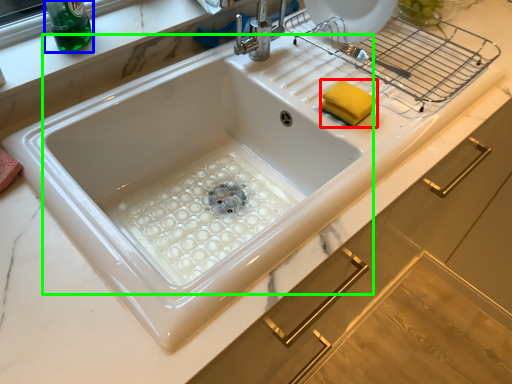
Question: Which object is positioned farthest from food (highlighted by a red box)? Select from beverage (highlighted by a blue box) and sink (highlighted by a green box).

Choices:
 (A) beverage
 (B) sink

Answer: (A)